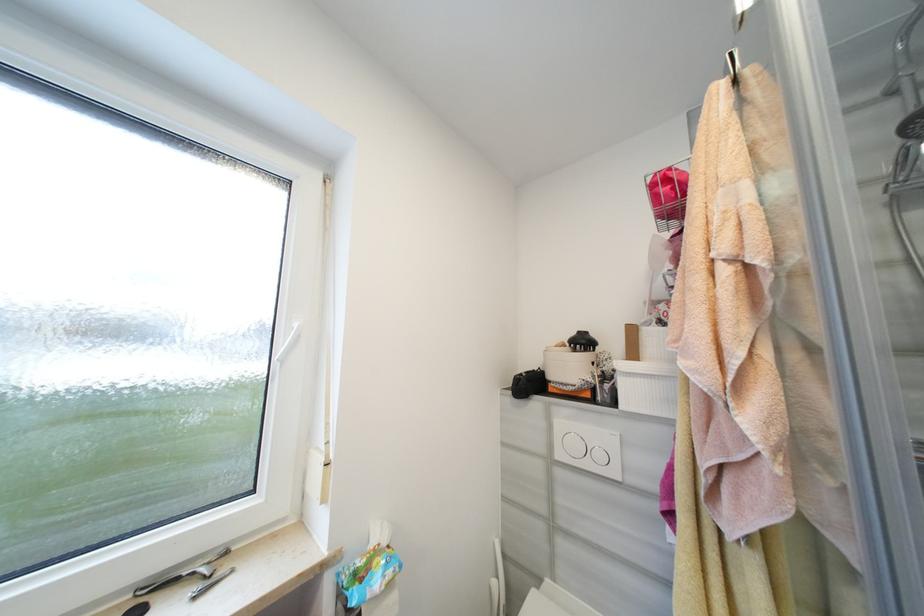
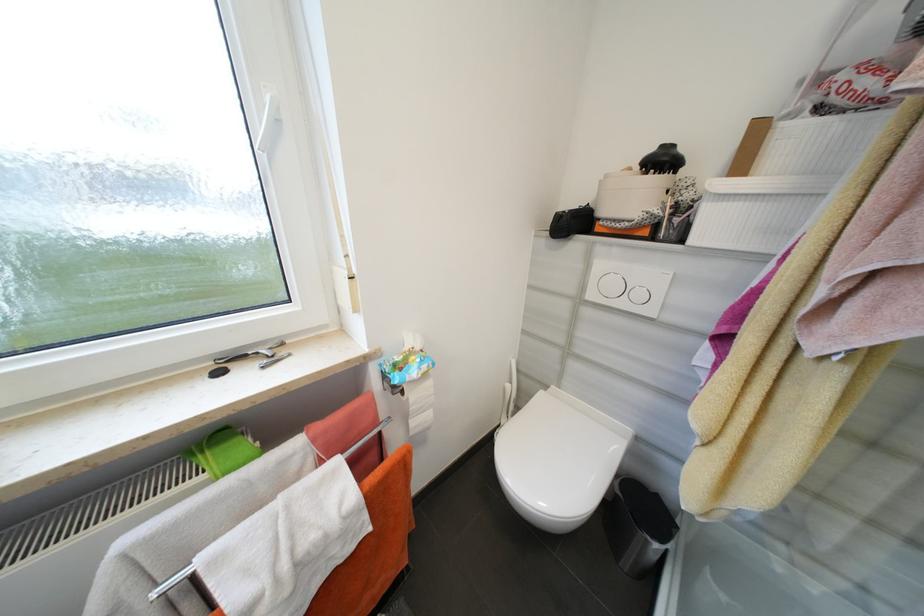
The point at [395,573] is marked in the first image. Where is the corresponding point in the second image?

(430, 368)